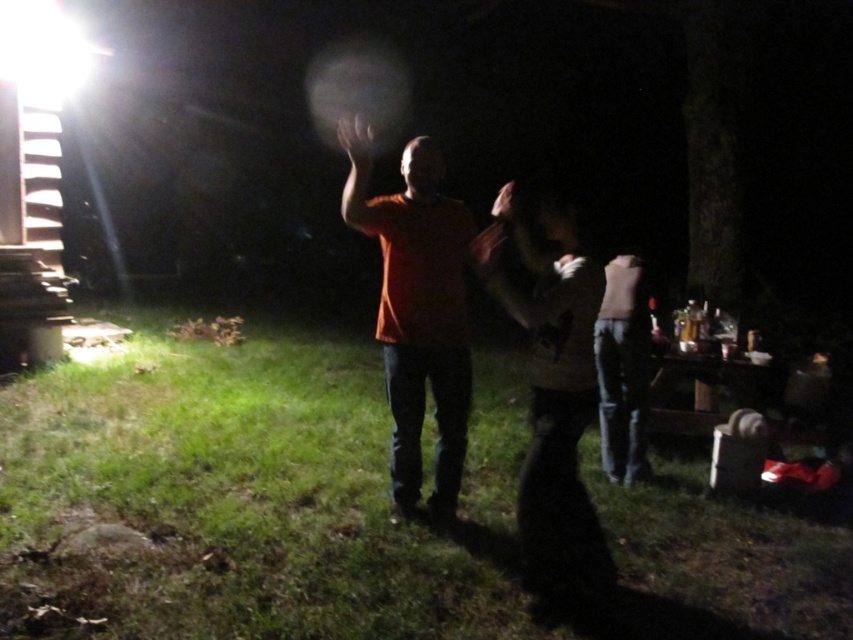
You are an observer looking at the nighttime scene. There is an orange matte shirt at center and a matte brown sweater at center. Which object is taller in the image?

The orange matte shirt at center is taller than the matte brown sweater at center.

You are standing in the nighttime scene with the bright light source. You need to locate the orange matte shirt at center. Based on the coordinates provided, where would you look first?

You should look at point 0.490 on the horizontal axis and 0.486 on the vertical axis to find the orange matte shirt at center.

You are trying to take a photo of both the orange matte shirt at center and the matte brown sweater at center. Since the flashlight is casting a bright beam, which object should you focus on to ensure both are visible in the photo?

The orange matte shirt at center is wider than the matte brown sweater at center, so focusing on the orange matte shirt at center would help ensure both are visible within the flashlight beam.